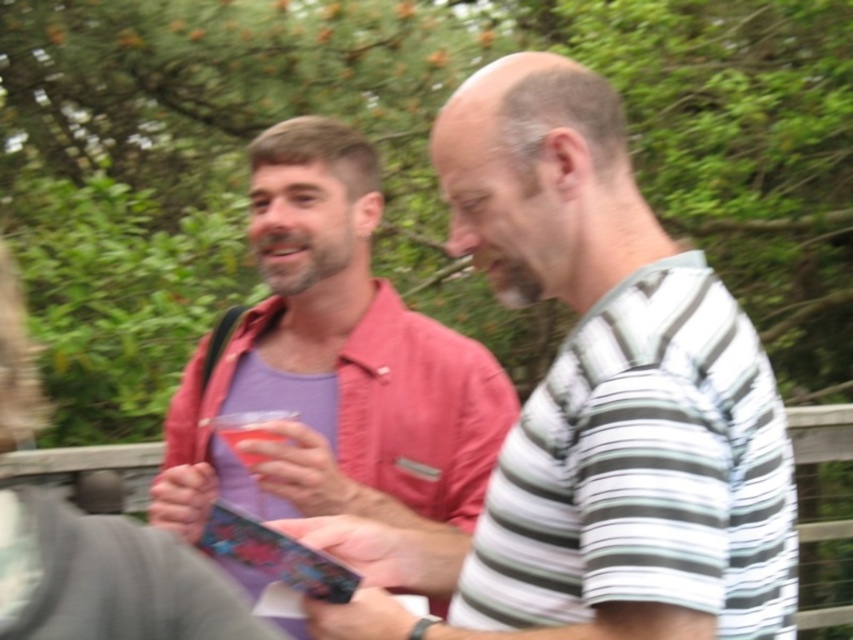
You are a photographer wanting to capture a group photo of the two people in the image. Since you want to ensure both the matte pink shirt at center and the matte pink shirt at left are visible in the frame, which person should be positioned closer to the camera to avoid being blocked?

The matte pink shirt at center is shorter than the matte pink shirt at left. To ensure both are visible, position the shorter matte pink shirt at center closer to the camera so it doesn t get blocked by the taller matte pink shirt at left.

You are a photographer setting up a tripod to capture a portrait of the two people in the scene. The tripod has a height limit of 1.5 meters. Considering the height of the matte pink shirt at left and the translucent plastic cup at center, can you determine if the tripod will be tall enough to frame both subjects adequately?

The matte pink shirt at left has a greater height compared to the translucent plastic cup at center. Since the tripod has a height limit of 1.5 meters, it should be sufficient to frame both subjects adequately as the tallest object, the matte pink shirt at left, is within the tripod height limit.